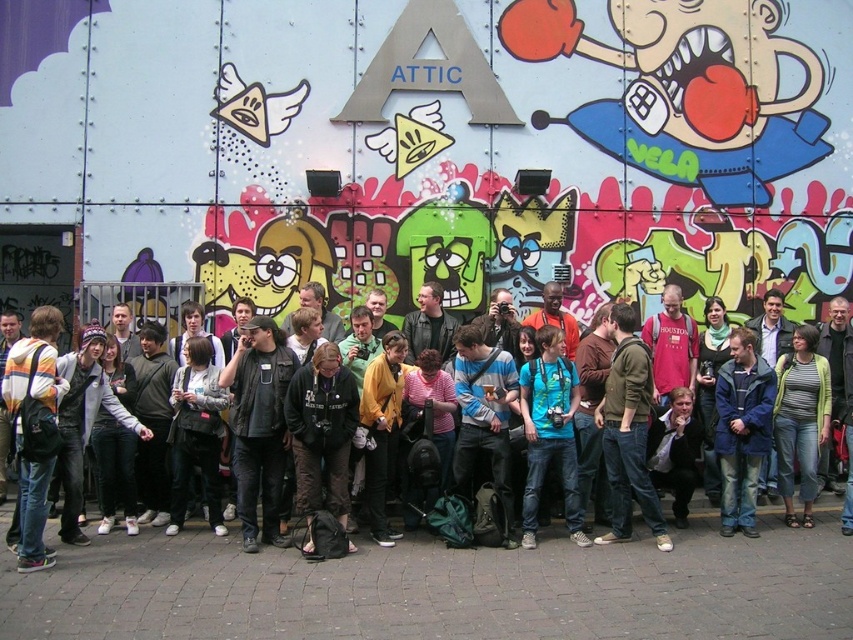
You are standing in front of the graffiti wall and notice two points marked on the wall. The first point is at coordinates point (733, 458) and the second is at point (548, 356). Which point is closer to your eyes?

Point (733, 458) is closer to the camera than point (548, 356), so the first point is closer to your eyes.

You are standing in front of the graffiti wall and want to know how far the point at coordinates (723, 461) is from you. Can you determine the distance?

The point at coordinates (723, 461) is 56.38 feet away from the viewer.